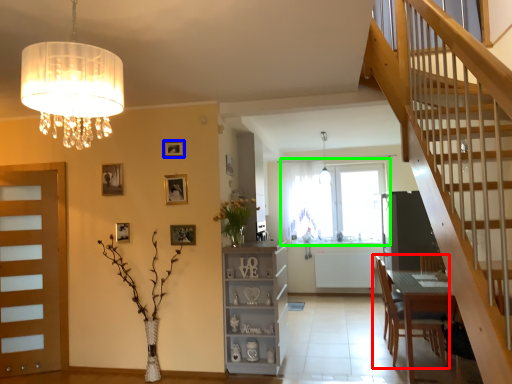
Question: Which object is positioned closest to chair (highlighted by a red box)? Select from picture frame (highlighted by a blue box) and window (highlighted by a green box).

Choices:
 (A) picture frame
 (B) window

Answer: (B)